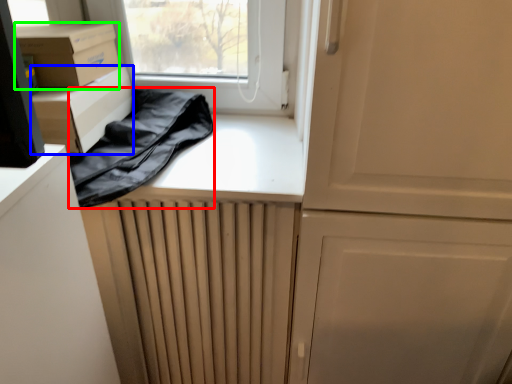
Question: Which object is positioned closest to clothing (highlighted by a red box)? Select from cardboard box (highlighted by a blue box) and cardboard box (highlighted by a green box).

Choices:
 (A) cardboard box
 (B) cardboard box

Answer: (A)